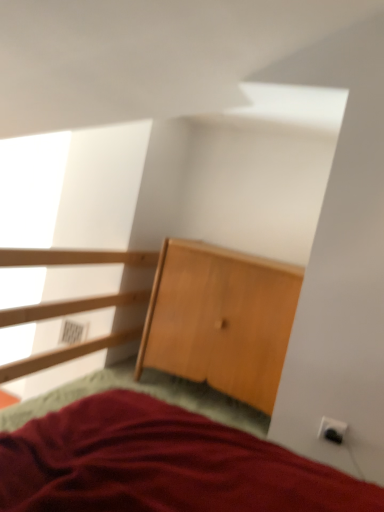
Question: Is transparent glass window at upper left beside light brown wooden dresser at center?

Choices:
 (A) yes
 (B) no

Answer: (B)

Question: Is transparent glass window at upper left closer to camera compared to light brown wooden dresser at center?

Choices:
 (A) no
 (B) yes

Answer: (B)

Question: From a real-world perspective, is transparent glass window at upper left located beneath light brown wooden dresser at center?

Choices:
 (A) no
 (B) yes

Answer: (A)

Question: Can you confirm if transparent glass window at upper left is positioned to the right of light brown wooden dresser at center?

Choices:
 (A) yes
 (B) no

Answer: (B)

Question: Is transparent glass window at upper left bigger than light brown wooden dresser at center?

Choices:
 (A) yes
 (B) no

Answer: (A)

Question: Does transparent glass window at upper left come behind light brown wooden dresser at center?

Choices:
 (A) no
 (B) yes

Answer: (A)

Question: Is white plastic electric outlet at lower right, which is the 2th electric outlet from back to front, bigger than white plastic electric outlet at lower right, placed as the second electric outlet when sorted from bottom to top?

Choices:
 (A) yes
 (B) no

Answer: (B)

Question: Considering the relative sizes of white plastic electric outlet at lower right, which is the 2th electric outlet from back to front, and white plastic electric outlet at lower right, the first electric outlet positioned from the top, in the image provided, is white plastic electric outlet at lower right, which is the 2th electric outlet from back to front, thinner than white plastic electric outlet at lower right, the first electric outlet positioned from the top,?

Choices:
 (A) no
 (B) yes

Answer: (B)

Question: From a real-world perspective, is white plastic electric outlet at lower right, placed as the 1th electric outlet when sorted from bottom to top, on white plastic electric outlet at lower right, the 2th electric outlet in the right-to-left sequence?

Choices:
 (A) no
 (B) yes

Answer: (B)

Question: Is white plastic electric outlet at lower right, placed as the 1th electric outlet when sorted from bottom to top, shorter than white plastic electric outlet at lower right, which is the 1th electric outlet in left-to-right order?

Choices:
 (A) yes
 (B) no

Answer: (A)

Question: Is white plastic electric outlet at lower right, arranged as the 2th electric outlet when viewed from the top, to the left of white plastic electric outlet at lower right, placed as the second electric outlet when sorted from bottom to top, from the viewer's perspective?

Choices:
 (A) no
 (B) yes

Answer: (A)

Question: Is white plastic electric outlet at lower right, which is the 2th electric outlet from back to front, oriented towards white plastic electric outlet at lower right, placed as the second electric outlet when sorted from bottom to top?

Choices:
 (A) yes
 (B) no

Answer: (B)

Question: From the image's perspective, would you say light brown wooden dresser at center is positioned over transparent glass window at upper left?

Choices:
 (A) no
 (B) yes

Answer: (A)